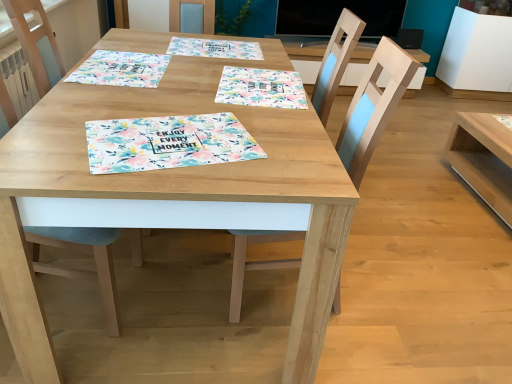
In order to face floral paper placemat at upper center, marked as the second tablecloth in a right-to-left arrangement, should I rotate leftwards or rightwards?

Turn left approximately 5.110 degrees to face it.

Describe the element at coordinates (121, 69) in the screenshot. I see `floral paper placemat at upper left, which is the 1th tablecloth in left-to-right order` at that location.

At what (x,y) coordinates should I click in order to perform the action: click on wooden table at center, which is the 2th table in right-to-left order. Please return your answer as a coordinate pair (x, y). Looking at the image, I should click on (173, 194).

How much space does light wood table at right, placed as the first table when sorted from right to left, occupy vertically?

light wood table at right, placed as the first table when sorted from right to left, is 16.08 inches in height.

Where is `wooden chair at center, the first chair when ordered from right to left`? This screenshot has width=512, height=384. wooden chair at center, the first chair when ordered from right to left is located at coordinates (373, 107).

Describe the element at coordinates (373, 107) in the screenshot. The width and height of the screenshot is (512, 384). I see `wooden chair at center, the first chair when ordered from right to left` at that location.

Image resolution: width=512 pixels, height=384 pixels. I want to click on floral paper placemat at upper center, marked as the second tablecloth in a right-to-left arrangement, so click(215, 48).

Could you tell me if wooden table at center, which is the 2th table in right-to-left order, is facing wooden chair at center, the second chair in the left-to-right sequence?

Yes, wooden table at center, which is the 2th table in right-to-left order, is turned towards wooden chair at center, the second chair in the left-to-right sequence.

Identify the location of the 2nd chair behind the wooden table at center, which is the 2th table in right-to-left order. The image size is (512, 384). (373, 107).

Does wooden table at center, which is the 2th table in right-to-left order, have a greater height compared to wooden chair at center, the first chair when ordered from right to left?

No, wooden table at center, which is the 2th table in right-to-left order, is not taller than wooden chair at center, the first chair when ordered from right to left.

Is wooden table at center, which is the 2th table in right-to-left order, far away from wooden chair at center, the first chair when ordered from right to left?

That's not correct — wooden table at center, which is the 2th table in right-to-left order, is a little close to wooden chair at center, the first chair when ordered from right to left.

How many degrees apart are the facing directions of floral paper placemat at center and light blue fabric chair at lower left, the 2th chair from the right?

The angle between the facing direction of floral paper placemat at center and the facing direction of light blue fabric chair at lower left, the 2th chair from the right, is 18.4 degrees.

From the image's perspective, between floral paper placemat at center and light blue fabric chair at lower left, which appears as the first chair when viewed from the left, who is located below?

light blue fabric chair at lower left, which appears as the first chair when viewed from the left, from the image's perspective.

Can you confirm if floral paper placemat at center is smaller than light blue fabric chair at lower left, which appears as the first chair when viewed from the left?

Indeed, floral paper placemat at center has a smaller size compared to light blue fabric chair at lower left, which appears as the first chair when viewed from the left.

Is light blue fabric chair at lower left, which appears as the first chair when viewed from the left, completely or partially inside floral paper placemat at center?

No, light blue fabric chair at lower left, which appears as the first chair when viewed from the left, is not inside floral paper placemat at center.

Which is closer, (x=109, y=102) or (x=174, y=161)?

Point (x=109, y=102) is positioned farther from the camera compared to point (x=174, y=161).

Is wooden table at center, which is the 2th table in right-to-left order, facing away from floral paper placemat at center?

That's not correct — wooden table at center, which is the 2th table in right-to-left order, is not looking away from floral paper placemat at center.

Is wooden table at center, which is counted as the first table, starting from the left, far from floral paper placemat at center?

No, wooden table at center, which is counted as the first table, starting from the left, is not far away from floral paper placemat at center.

Consider the image. How different are the orientations of wooden table at center, which is counted as the first table, starting from the left, and floral paper placemat at center in degrees?

17.5 degrees separate the facing orientations of wooden table at center, which is counted as the first table, starting from the left, and floral paper placemat at center.

Considering the points (266, 87) and (356, 116), which point is in front, point (266, 87) or point (356, 116)?

Point (356, 116)

Is floral paper placemat at center, marked as the first tablecloth in a right-to-left arrangement, oriented towards wooden chair at center, the first chair when ordered from right to left?

No, floral paper placemat at center, marked as the first tablecloth in a right-to-left arrangement, does not turn towards wooden chair at center, the first chair when ordered from right to left.

In the scene shown: Who is shorter, floral paper placemat at center, marked as the first tablecloth in a right-to-left arrangement, or wooden chair at center, the first chair when ordered from right to left?

With less height is floral paper placemat at center, marked as the first tablecloth in a right-to-left arrangement.

Is floral paper placemat at center, marked as the first tablecloth in a right-to-left arrangement, located outside wooden chair at center, the first chair when ordered from right to left?

Yes, floral paper placemat at center, marked as the first tablecloth in a right-to-left arrangement, is located beyond the bounds of wooden chair at center, the first chair when ordered from right to left.

From the image's perspective, would you say floral paper placemat at upper left, which is the 1th tablecloth in left-to-right order, is shown under floral paper placemat at center?

No, from the image's perspective, floral paper placemat at upper left, which is the 1th tablecloth in left-to-right order, is not beneath floral paper placemat at center.

Locate an element on the screen. place mat below the floral paper placemat at upper left, which ranks as the 3th tablecloth in right-to-left order (from the image's perspective) is located at coordinates (168, 143).

In the image, is floral paper placemat at upper left, which is the 1th tablecloth in left-to-right order, positioned in front of or behind floral paper placemat at center?

In the image, floral paper placemat at upper left, which is the 1th tablecloth in left-to-right order, appears behind floral paper placemat at center.

Can you confirm if floral paper placemat at upper left, which is the 1th tablecloth in left-to-right order, is bigger than floral paper placemat at center?

Indeed, floral paper placemat at upper left, which is the 1th tablecloth in left-to-right order, has a larger size compared to floral paper placemat at center.

Is light wood table at right, placed as the first table when sorted from right to left, outside of wooden chair at center, the first chair when ordered from right to left?

That's correct, light wood table at right, placed as the first table when sorted from right to left, is outside of wooden chair at center, the first chair when ordered from right to left.

From the image's perspective, between light wood table at right, marked as the second table in a left-to-right arrangement, and wooden chair at center, the second chair in the left-to-right sequence, which one is located above?

light wood table at right, marked as the second table in a left-to-right arrangement, is shown above in the image.

Can you confirm if floral paper placemat at upper center, the second tablecloth in the left-to-right sequence, is thinner than floral paper placemat at center?

Incorrect, the width of floral paper placemat at upper center, the second tablecloth in the left-to-right sequence, is not less than that of floral paper placemat at center.

Considering the positions of point (245, 58) and point (187, 142), is point (245, 58) closer or farther from the camera than point (187, 142)?

Clearly, point (245, 58) is more distant from the camera than point (187, 142).

Is floral paper placemat at upper center, the second tablecloth in the left-to-right sequence, bigger than floral paper placemat at center?

Correct, floral paper placemat at upper center, the second tablecloth in the left-to-right sequence, is larger in size than floral paper placemat at center.

The height and width of the screenshot is (384, 512). Find the location of `table that is the 1st object located above the wooden chair at center, the first chair when ordered from right to left (from the image's perspective)`. table that is the 1st object located above the wooden chair at center, the first chair when ordered from right to left (from the image's perspective) is located at coordinates (173, 194).

Locate an element on the screen. This screenshot has height=384, width=512. chair on the left of floral paper placemat at center is located at coordinates (81, 270).

When comparing their distances from light wood table at right, placed as the first table when sorted from right to left, does wooden chair at center, the first chair when ordered from right to left, or floral paper placemat at center seem further?

Based on the image, floral paper placemat at center appears to be further to light wood table at right, placed as the first table when sorted from right to left.

Which object lies further to the anchor point light wood table at right, placed as the first table when sorted from right to left, floral paper placemat at center, marked as the first tablecloth in a right-to-left arrangement, or light blue fabric chair at lower left, which appears as the first chair when viewed from the left?

light blue fabric chair at lower left, which appears as the first chair when viewed from the left, is positioned further to the anchor light wood table at right, placed as the first table when sorted from right to left.

From the image, which object appears to be nearer to floral paper placemat at upper center, the second tablecloth in the left-to-right sequence, floral paper placemat at center, the third tablecloth when ordered from left to right, or floral paper placemat at upper left, which ranks as the 3th tablecloth in right-to-left order?

Based on the image, floral paper placemat at upper left, which ranks as the 3th tablecloth in right-to-left order, appears to be nearer to floral paper placemat at upper center, the second tablecloth in the left-to-right sequence.

From the image, which object appears to be nearer to floral paper placemat at upper center, the second tablecloth in the left-to-right sequence, wooden chair at center, the first chair when ordered from right to left, or floral paper placemat at center?

The object closer to floral paper placemat at upper center, the second tablecloth in the left-to-right sequence, is wooden chair at center, the first chair when ordered from right to left.

Based on their spatial positions, is floral paper placemat at center, the third tablecloth when ordered from left to right, or floral paper placemat at upper center, the second tablecloth in the left-to-right sequence, further from light blue fabric chair at lower left, the 2th chair from the right?

Among the two, floral paper placemat at upper center, the second tablecloth in the left-to-right sequence, is located further to light blue fabric chair at lower left, the 2th chair from the right.

Considering their positions, is floral paper placemat at upper left, which ranks as the 3th tablecloth in right-to-left order, positioned further to wooden chair at center, the first chair when ordered from right to left, than wooden table at center, which is counted as the first table, starting from the left?

Among the two, floral paper placemat at upper left, which ranks as the 3th tablecloth in right-to-left order, is located further to wooden chair at center, the first chair when ordered from right to left.

Based on their spatial positions, is floral paper placemat at upper left, which is the 1th tablecloth in left-to-right order, or wooden table at center, which is counted as the first table, starting from the left, closer to light wood table at right, placed as the first table when sorted from right to left?

wooden table at center, which is counted as the first table, starting from the left, is positioned closer to the anchor light wood table at right, placed as the first table when sorted from right to left.

Consider the image. When comparing their distances from wooden table at center, which is the 2th table in right-to-left order, does floral paper placemat at center or light wood table at right, marked as the second table in a left-to-right arrangement, seem further?

light wood table at right, marked as the second table in a left-to-right arrangement, is further to wooden table at center, which is the 2th table in right-to-left order.

This screenshot has width=512, height=384. Find the location of `chair between floral paper placemat at upper center, marked as the second tablecloth in a right-to-left arrangement, and light wood table at right, marked as the second table in a left-to-right arrangement, in the horizontal direction`. chair between floral paper placemat at upper center, marked as the second tablecloth in a right-to-left arrangement, and light wood table at right, marked as the second table in a left-to-right arrangement, in the horizontal direction is located at coordinates (373, 107).

This screenshot has height=384, width=512. Identify the location of tablecloth between floral paper placemat at upper left, which is the 1th tablecloth in left-to-right order, and floral paper placemat at center, marked as the first tablecloth in a right-to-left arrangement. (215, 48).

You are a GUI agent. You are given a task and a screenshot of the screen. Output one action in this format:
    pyautogui.click(x=<x>, y=<y>)
    Task: Click on the place mat between wooden table at center, which is counted as the first table, starting from the left, and light wood table at right, placed as the first table when sorted from right to left
    
    Given the screenshot: What is the action you would take?
    pyautogui.click(x=168, y=143)

You are a GUI agent. You are given a task and a screenshot of the screen. Output one action in this format:
    pyautogui.click(x=<x>, y=<y>)
    Task: Click on the place mat between wooden table at center, which is counted as the first table, starting from the left, and floral paper placemat at upper left, which ranks as the 3th tablecloth in right-to-left order, along the z-axis
    This screenshot has width=512, height=384.
    Given the screenshot: What is the action you would take?
    pyautogui.click(x=168, y=143)